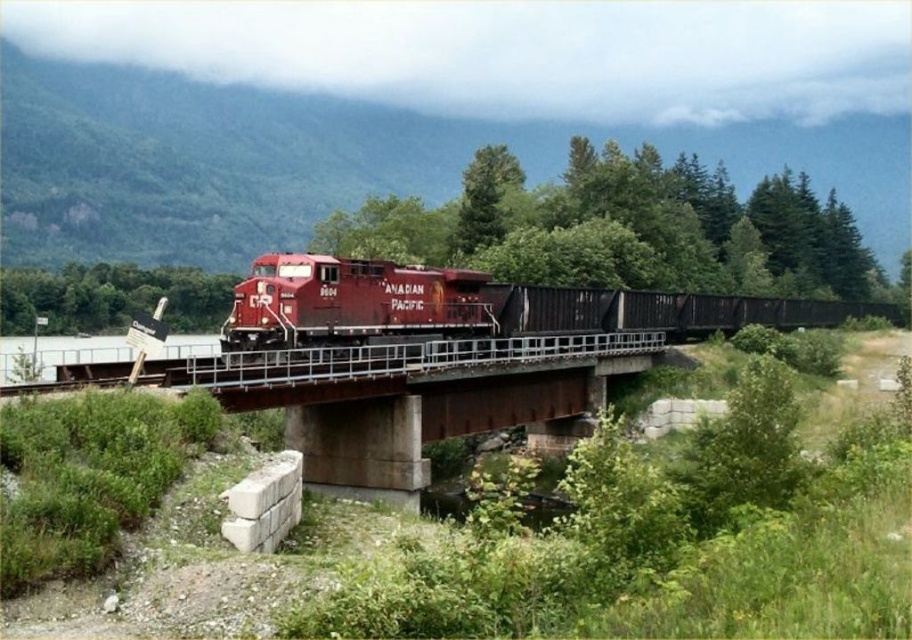
Is point (550, 429) in front of point (588, 291)?

Yes, it is in front of point (588, 291).

Between point (150, 378) and point (773, 324), which one is positioned behind?

The point (773, 324) is behind.

This screenshot has height=640, width=912. I want to click on rusty metal bridge at center, so pyautogui.click(x=409, y=394).

Does rusty metal bridge at center appear on the left side of green leafy tree at left?

In fact, rusty metal bridge at center is to the right of green leafy tree at left.

Does rusty metal bridge at center have a lesser height compared to green leafy tree at left?

Indeed, rusty metal bridge at center has a lesser height compared to green leafy tree at left.

The width and height of the screenshot is (912, 640). Find the location of `rusty metal bridge at center`. rusty metal bridge at center is located at coordinates (409, 394).

Between point (627, 273) and point (291, 317), which one is positioned in front?

Point (291, 317)

The image size is (912, 640). I want to click on green leafy tree at center, so click(x=622, y=227).

Does point (333, 230) come behind point (246, 324)?

Yes, it is behind point (246, 324).

Locate an element on the screen. The image size is (912, 640). green leafy tree at center is located at coordinates (622, 227).